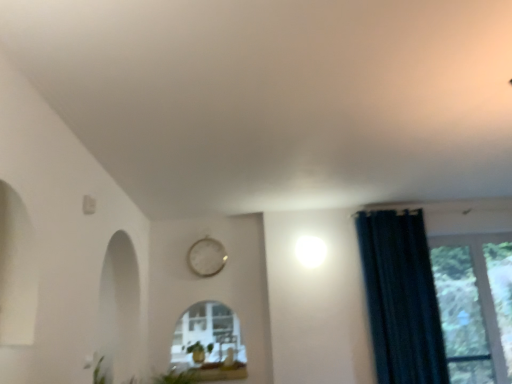
Question: From a real-world perspective, is transparent glass window at right on white metallic clock at upper center?

Choices:
 (A) yes
 (B) no

Answer: (B)

Question: Considering the relative sizes of transparent glass window at right and white metallic clock at upper center in the image provided, is transparent glass window at right smaller than white metallic clock at upper center?

Choices:
 (A) yes
 (B) no

Answer: (B)

Question: Can you confirm if transparent glass window at right is thinner than white metallic clock at upper center?

Choices:
 (A) no
 (B) yes

Answer: (B)

Question: Can you confirm if transparent glass window at right is bigger than white metallic clock at upper center?

Choices:
 (A) yes
 (B) no

Answer: (A)

Question: Is transparent glass window at right far from white metallic clock at upper center?

Choices:
 (A) no
 (B) yes

Answer: (B)

Question: From their relative heights in the image, would you say white metallic clock at upper center is taller or shorter than transparent glass window at right?

Choices:
 (A) tall
 (B) short

Answer: (B)

Question: From the image's perspective, relative to transparent glass window at right, is white metallic clock at upper center above or below?

Choices:
 (A) below
 (B) above

Answer: (B)

Question: Would you say white metallic clock at upper center is inside or outside transparent glass window at right?

Choices:
 (A) outside
 (B) inside

Answer: (A)

Question: Considering the positions of white metallic clock at upper center and transparent glass window at right in the image, is white metallic clock at upper center wider or thinner than transparent glass window at right?

Choices:
 (A) thin
 (B) wide

Answer: (B)

Question: Does point (193, 256) appear closer or farther from the camera than point (200, 344)?

Choices:
 (A) closer
 (B) farther

Answer: (B)

Question: Is white metallic clock at upper center to the left or to the right of green matte plant at lower center in the image?

Choices:
 (A) left
 (B) right

Answer: (B)

Question: In terms of height, does white metallic clock at upper center look taller or shorter compared to green matte plant at lower center?

Choices:
 (A) tall
 (B) short

Answer: (A)

Question: From a real-world perspective, relative to green matte plant at lower center, is white metallic clock at upper center vertically above or below?

Choices:
 (A) above
 (B) below

Answer: (A)

Question: Is transparent glass window at right wider or thinner than white glossy window sill at lower center?

Choices:
 (A) thin
 (B) wide

Answer: (A)

Question: Would you say transparent glass window at right is to the left or to the right of white glossy window sill at lower center in the picture?

Choices:
 (A) right
 (B) left

Answer: (A)